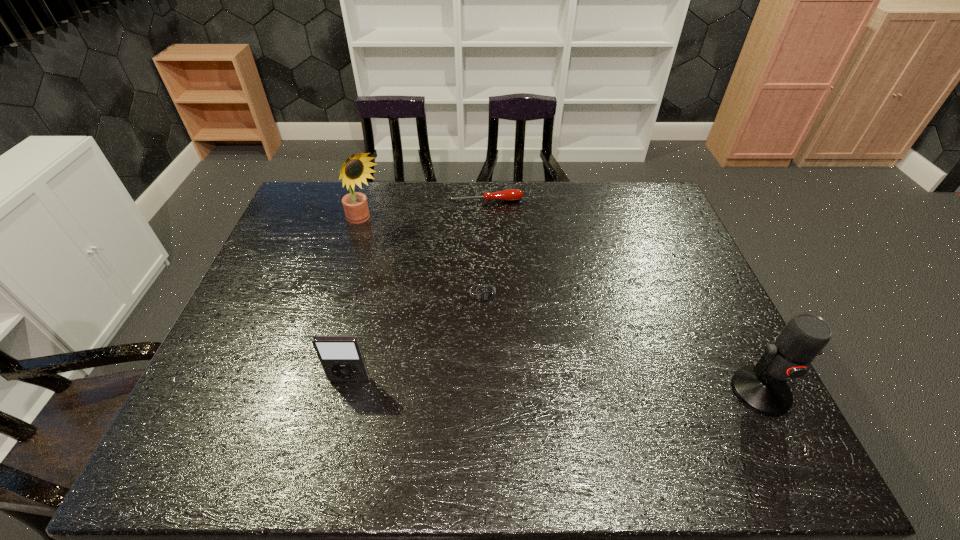
Where is `microphone that is at the near edge`? This screenshot has width=960, height=540. microphone that is at the near edge is located at coordinates (762, 388).

Find the location of a particular element. This screenshot has width=960, height=540. object that is at the right edge is located at coordinates (762, 388).

This screenshot has width=960, height=540. In order to click on object positioned at the near right corner in this screenshot , I will do `click(762, 388)`.

In the image, there is a desktop. Where is `free region at the far edge`? The image size is (960, 540). free region at the far edge is located at coordinates (597, 185).

Locate an element on the screen. vacant space at the near edge of the desktop is located at coordinates (312, 411).

Where is `vacant space at the left edge`? Image resolution: width=960 pixels, height=540 pixels. vacant space at the left edge is located at coordinates (252, 292).

In the image, there is a desktop. At what (x,y) coordinates should I click in order to perform the action: click on vacant space at the right edge. Please return your answer as a coordinate pair (x, y). Image resolution: width=960 pixels, height=540 pixels. Looking at the image, I should click on (702, 305).

I want to click on blank area at the far left corner, so coord(326,189).

At what (x,y) coordinates should I click in order to perform the action: click on blank area at the far right corner. Please return your answer as a coordinate pair (x, y). Looking at the image, I should click on point(628,207).

Identify the location of vacant space that is in between the second farthest object and the microphone. (563, 307).